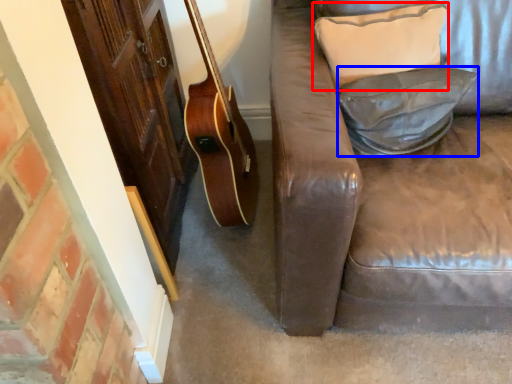
Question: Which of the following is the closest to the observer, pillow (highlighted by a red box) or pillow (highlighted by a blue box)?

Choices:
 (A) pillow
 (B) pillow

Answer: (B)